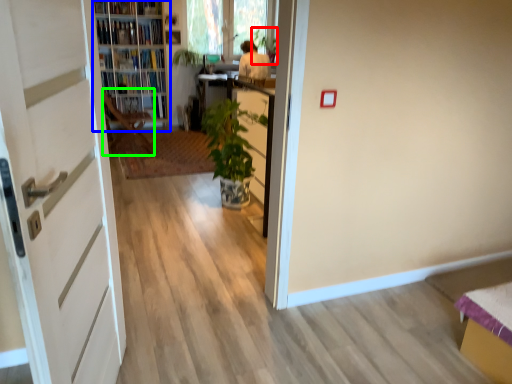
Question: Which is farther away from plant (highlighted by a red box)? shelf (highlighted by a blue box) or chair (highlighted by a green box)?

Choices:
 (A) shelf
 (B) chair

Answer: (B)